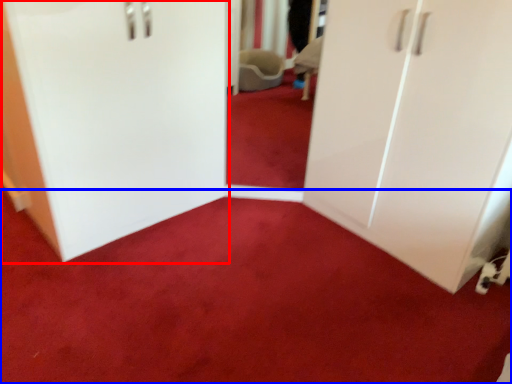
Question: Which of the following is the closest to the observer, door (highlighted by a red box) or plain (highlighted by a blue box)?

Choices:
 (A) door
 (B) plain

Answer: (B)